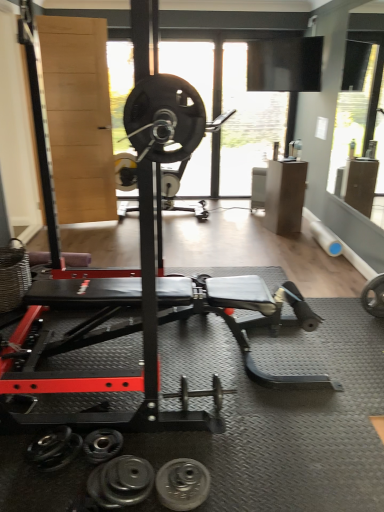
This screenshot has height=512, width=384. I want to click on silver metallic dumbbell at center, the 3th dumbbell when ordered from bottom to top, so click(x=201, y=393).

From the picture: Measure the distance between black rubber dumbbell at lower center, the 1th dumbbell from the front, and camera.

They are 4.98 feet apart.

Where is `transparent glass window screen at upper center`? The width and height of the screenshot is (384, 512). transparent glass window screen at upper center is located at coordinates (247, 124).

Could you tell me if transparent glass window screen at upper center is facing black rubber weight plate at lower center?

Yes, transparent glass window screen at upper center is turned towards black rubber weight plate at lower center.

Considering the relative positions of transparent glass window screen at upper center and black rubber weight plate at lower center in the image provided, is transparent glass window screen at upper center in front of black rubber weight plate at lower center?

No, transparent glass window screen at upper center is further to the viewer.

From a real-world perspective, is transparent glass window screen at upper center positioned over black rubber weight plate at lower center based on gravity?

Yes, from a real-world perspective, transparent glass window screen at upper center is above black rubber weight plate at lower center.

From the image's perspective, between transparent glass window screen at upper center and black rubber weight plate at lower center, which one is located above?

transparent glass window screen at upper center, from the image's perspective.

Measure the distance between silver metallic dumbbell at center, which appears as the third dumbbell when viewed from the left, and black rubber dumbbell at lower center, which is the third dumbbell from back to front.

silver metallic dumbbell at center, which appears as the third dumbbell when viewed from the left, is 49.76 centimeters from black rubber dumbbell at lower center, which is the third dumbbell from back to front.

How different are the orientations of silver metallic dumbbell at center, which appears as the third dumbbell when viewed from the left, and black rubber dumbbell at lower center, the third dumbbell in the top-to-bottom sequence, in degrees?

97.5 degrees.

Based on their positions, is silver metallic dumbbell at center, the 1th dumbbell positioned from the top, located to the left or right of black rubber dumbbell at lower center, which is the third dumbbell from back to front?

Clearly, silver metallic dumbbell at center, the 1th dumbbell positioned from the top, is on the right of black rubber dumbbell at lower center, which is the third dumbbell from back to front, in the image.

At what (x,y) coordinates should I click in order to perform the action: click on the 1st dumbbell to the left of the silver metallic dumbbell at center, the 1th dumbbell positioned from the top, starting your count from the anchor. Please return your answer as a coordinate pair (x, y). This screenshot has width=384, height=512. Looking at the image, I should click on [x=121, y=482].

From a real-world perspective, is silver metallic dumbbell at center, the 1th dumbbell positioned from the top, under black rubber weight plate at lower center?

No, from a real-world perspective, silver metallic dumbbell at center, the 1th dumbbell positioned from the top, is not below black rubber weight plate at lower center.

Can you confirm if silver metallic dumbbell at center, the 1th dumbbell positioned from the top, is smaller than black rubber weight plate at lower center?

Incorrect, silver metallic dumbbell at center, the 1th dumbbell positioned from the top, is not smaller in size than black rubber weight plate at lower center.

Could you tell me if silver metallic dumbbell at center, which appears as the third dumbbell when viewed from the left, is facing black rubber weight plate at lower center?

No, silver metallic dumbbell at center, which appears as the third dumbbell when viewed from the left, is not aimed at black rubber weight plate at lower center.

Is black rubber dumbbell at lower center, which is the 2th dumbbell from right to left, directly adjacent to black rubber dumbbell at lower center, the 2th dumbbell in the top-to-bottom sequence?

No, black rubber dumbbell at lower center, which is the 2th dumbbell from right to left, is not next to black rubber dumbbell at lower center, the 2th dumbbell in the top-to-bottom sequence.

Does black rubber dumbbell at lower center, the third dumbbell in the top-to-bottom sequence, turn towards black rubber dumbbell at lower center, which is the second dumbbell in back-to-front order?

No, black rubber dumbbell at lower center, the third dumbbell in the top-to-bottom sequence, is not aimed at black rubber dumbbell at lower center, which is the second dumbbell in back-to-front order.

What are the coordinates of `dumbbell in front of the black rubber dumbbell at lower center, the 2th dumbbell from the bottom` in the screenshot? It's located at (121, 482).

Considering the relative sizes of black rubber dumbbell at lower center, which is the third dumbbell from back to front, and black rubber dumbbell at lower center, which is the 1th dumbbell from left to right, in the image provided, is black rubber dumbbell at lower center, which is the third dumbbell from back to front, bigger than black rubber dumbbell at lower center, which is the 1th dumbbell from left to right,?

Correct, black rubber dumbbell at lower center, which is the third dumbbell from back to front, is larger in size than black rubber dumbbell at lower center, which is the 1th dumbbell from left to right.

Can you tell me how much black rubber weight plate at lower center and black rubber dumbbell at lower center, positioned as the second dumbbell in left-to-right order, differ in facing direction?

The facing directions of black rubber weight plate at lower center and black rubber dumbbell at lower center, positioned as the second dumbbell in left-to-right order, are 93.7 degrees apart.

Which is behind, point (186, 490) or point (144, 490)?

Positioned behind is point (186, 490).

Find the location of a particular element. This screenshot has height=512, width=384. wheel below the black rubber dumbbell at lower center, positioned as the second dumbbell in left-to-right order (from the image's perspective) is located at coordinates click(182, 484).

Would you say black rubber weight plate at lower center is outside black rubber dumbbell at lower center, the 1th dumbbell from the front?

Yes.

Find the location of a particular element. The height and width of the screenshot is (512, 384). dumbbell that is the 2nd one when counting backward from the black rubber weight plate at lower center is located at coordinates (201, 393).

Does black rubber weight plate at lower center turn towards silver metallic dumbbell at center, the first dumbbell when ordered from back to front?

No.

Can you tell me how much black rubber weight plate at lower center and silver metallic dumbbell at center, the 1th dumbbell positioned from the top, differ in facing direction?

There is a 3.81-degree angle between the facing directions of black rubber weight plate at lower center and silver metallic dumbbell at center, the 1th dumbbell positioned from the top.

In the scene shown: From a real-world perspective, is black rubber dumbbell at lower center, the 2th dumbbell from the bottom, located higher than black rubber dumbbell at lower center, which appears as the first dumbbell when ordered from the bottom?

Actually, black rubber dumbbell at lower center, the 2th dumbbell from the bottom, is physically below black rubber dumbbell at lower center, which appears as the first dumbbell when ordered from the bottom, in the real world.

From the image's perspective, which one is positioned higher, black rubber dumbbell at lower center, which is the 1th dumbbell from left to right, or black rubber dumbbell at lower center, which appears as the first dumbbell when ordered from the bottom?

black rubber dumbbell at lower center, which is the 1th dumbbell from left to right, appears higher in the image.

Is the position of black rubber dumbbell at lower center, the 2th dumbbell in the top-to-bottom sequence, less distant than that of black rubber dumbbell at lower center, which is the third dumbbell from back to front?

No, the depth of black rubber dumbbell at lower center, the 2th dumbbell in the top-to-bottom sequence, is greater than that of black rubber dumbbell at lower center, which is the third dumbbell from back to front.

Considering the sizes of objects black rubber dumbbell at lower center, which is the second dumbbell in back-to-front order, and black rubber dumbbell at lower center, which appears as the first dumbbell when ordered from the bottom, in the image provided, who is taller, black rubber dumbbell at lower center, which is the second dumbbell in back-to-front order, or black rubber dumbbell at lower center, which appears as the first dumbbell when ordered from the bottom,?

black rubber dumbbell at lower center, which appears as the first dumbbell when ordered from the bottom, is taller.

The height and width of the screenshot is (512, 384). I want to click on window screen located above the black rubber weight plate at lower center (from the image's perspective), so click(x=247, y=124).

From a real-world perspective, which dumbbell is the 1st one underneath the silver metallic dumbbell at center, the first dumbbell when ordered from back to front? Please provide its 2D coordinates.

[(121, 482)]

Based on their spatial positions, is silver metallic dumbbell at center, the 1th dumbbell positioned from the top, or black rubber weight plate at lower center further from transparent glass window screen at upper center?

Among the two, black rubber weight plate at lower center is located further to transparent glass window screen at upper center.

Consider the image. Looking at the image, which one is located closer to black rubber dumbbell at lower center, which is the 2th dumbbell from right to left, silver metallic dumbbell at center, the 1th dumbbell positioned from the top, or black rubber weight plate at lower center?

black rubber weight plate at lower center.

From the picture: Considering their positions, is black rubber dumbbell at lower center, which is the 1th dumbbell from left to right, positioned closer to transparent glass window screen at upper center than black rubber dumbbell at lower center, positioned as the second dumbbell in left-to-right order?

black rubber dumbbell at lower center, which is the 1th dumbbell from left to right, is positioned closer to the anchor transparent glass window screen at upper center.

Estimate the real-world distances between objects in this image. Which object is further from black rubber weight plate at lower center, black rubber dumbbell at lower center, the 2th dumbbell from the bottom, or silver metallic dumbbell at center, the 1th dumbbell positioned from the top?

The object further to black rubber weight plate at lower center is silver metallic dumbbell at center, the 1th dumbbell positioned from the top.

In the scene shown: Looking at the image, which one is located closer to black rubber dumbbell at lower center, the third dumbbell in the top-to-bottom sequence, transparent glass window screen at upper center or black rubber dumbbell at lower center, the 2th dumbbell in the top-to-bottom sequence?

black rubber dumbbell at lower center, the 2th dumbbell in the top-to-bottom sequence, lies closer to black rubber dumbbell at lower center, the third dumbbell in the top-to-bottom sequence, than the other object.

Based on their spatial positions, is black rubber dumbbell at lower center, which appears as the first dumbbell when ordered from the bottom, or black rubber weight plate at lower center closer to silver metallic dumbbell at center, the 3th dumbbell when ordered from bottom to top?

black rubber weight plate at lower center is closer to silver metallic dumbbell at center, the 3th dumbbell when ordered from bottom to top.

Based on their spatial positions, is black rubber dumbbell at lower center, which is counted as the 3th dumbbell, starting from the right, or silver metallic dumbbell at center, the third dumbbell in the front-to-back sequence, further from black rubber dumbbell at lower center, positioned as the second dumbbell in left-to-right order?

silver metallic dumbbell at center, the third dumbbell in the front-to-back sequence, is positioned further to the anchor black rubber dumbbell at lower center, positioned as the second dumbbell in left-to-right order.

Which object lies nearer to the anchor point black rubber weight plate at lower center, silver metallic dumbbell at center, the third dumbbell in the front-to-back sequence, or transparent glass window screen at upper center?

Among the two, silver metallic dumbbell at center, the third dumbbell in the front-to-back sequence, is located nearer to black rubber weight plate at lower center.

This screenshot has width=384, height=512. Identify the location of dumbbell between black rubber dumbbell at lower center, which is the 1th dumbbell from left to right, and silver metallic dumbbell at center, which appears as the third dumbbell when viewed from the left, in the horizontal direction. (121, 482).

Where is `wheel positioned between black rubber dumbbell at lower center, the 1th dumbbell from the front, and silver metallic dumbbell at center, which appears as the third dumbbell when viewed from the left, from near to far`? wheel positioned between black rubber dumbbell at lower center, the 1th dumbbell from the front, and silver metallic dumbbell at center, which appears as the third dumbbell when viewed from the left, from near to far is located at coordinates (182, 484).

Image resolution: width=384 pixels, height=512 pixels. I want to click on wheel between black rubber dumbbell at lower center, which is counted as the 3th dumbbell, starting from the right, and silver metallic dumbbell at center, the third dumbbell in the front-to-back sequence, so (x=182, y=484).

Where is `wheel located between black rubber dumbbell at lower center, positioned as the second dumbbell in left-to-right order, and transparent glass window screen at upper center in the depth direction`? This screenshot has width=384, height=512. wheel located between black rubber dumbbell at lower center, positioned as the second dumbbell in left-to-right order, and transparent glass window screen at upper center in the depth direction is located at coordinates (182, 484).